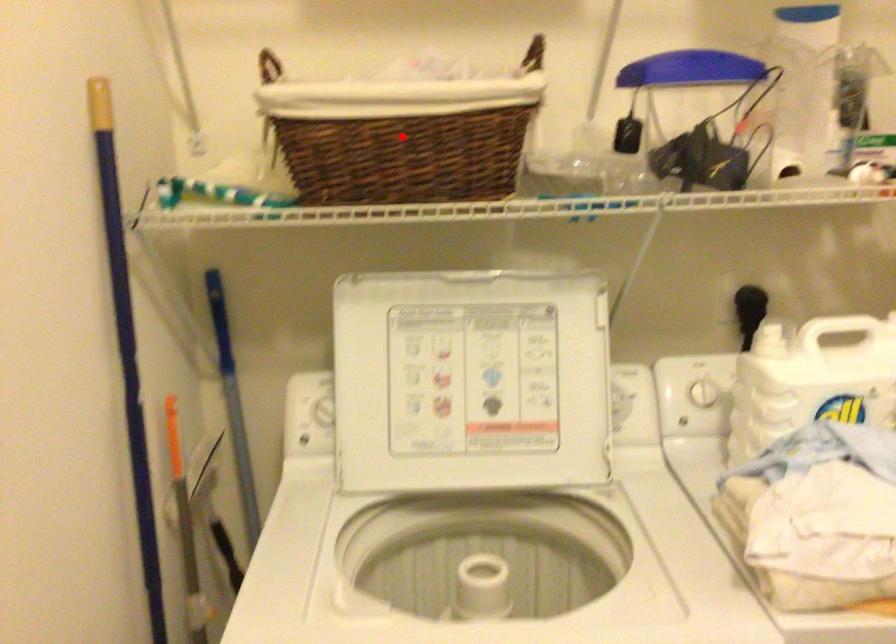
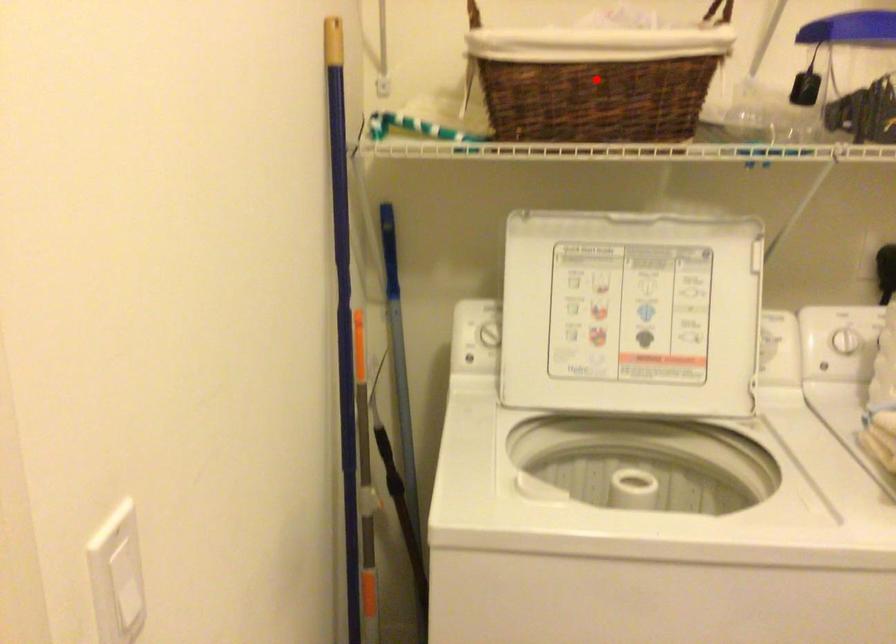
I am providing you with two images of the same scene from different viewpoints. A red point is marked on the first image and another point is marked on the second image. Is the marked point in image1 the same physical position as the marked point in image2?

Yes